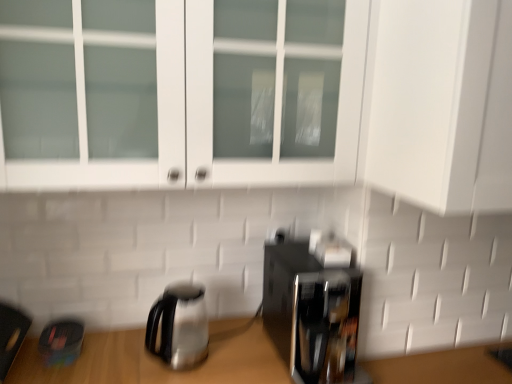
Question: Is stainless steel kettle at lower left directly adjacent to white glass cabinet at upper center?

Choices:
 (A) yes
 (B) no

Answer: (B)

Question: From a real-world perspective, does stainless steel kettle at lower left stand above white glass cabinet at upper center?

Choices:
 (A) no
 (B) yes

Answer: (A)

Question: Is there a large distance between stainless steel kettle at lower left and white glass cabinet at upper center?

Choices:
 (A) no
 (B) yes

Answer: (A)

Question: Is stainless steel kettle at lower left turned away from white glass cabinet at upper center?

Choices:
 (A) no
 (B) yes

Answer: (A)

Question: Does stainless steel kettle at lower left have a lesser height compared to white glass cabinet at upper center?

Choices:
 (A) yes
 (B) no

Answer: (A)

Question: Can you confirm if stainless steel kettle at lower left is positioned to the left of white glass cabinet at upper center?

Choices:
 (A) yes
 (B) no

Answer: (A)

Question: Is black glossy coffee maker at lower right touching white glass cabinet at upper center?

Choices:
 (A) yes
 (B) no

Answer: (B)

Question: Can you confirm if black glossy coffee maker at lower right is shorter than white glass cabinet at upper center?

Choices:
 (A) yes
 (B) no

Answer: (A)

Question: Is black glossy coffee maker at lower right closer to camera compared to white glass cabinet at upper center?

Choices:
 (A) no
 (B) yes

Answer: (A)

Question: Does black glossy coffee maker at lower right have a greater width compared to white glass cabinet at upper center?

Choices:
 (A) no
 (B) yes

Answer: (A)

Question: Is black glossy coffee maker at lower right aimed at white glass cabinet at upper center?

Choices:
 (A) no
 (B) yes

Answer: (A)

Question: Is black glossy coffee maker at lower right oriented away from white glass cabinet at upper center?

Choices:
 (A) yes
 (B) no

Answer: (B)

Question: From the image's perspective, does stainless steel kettle at lower left appear lower than black glossy coffee maker at lower right?

Choices:
 (A) no
 (B) yes

Answer: (B)